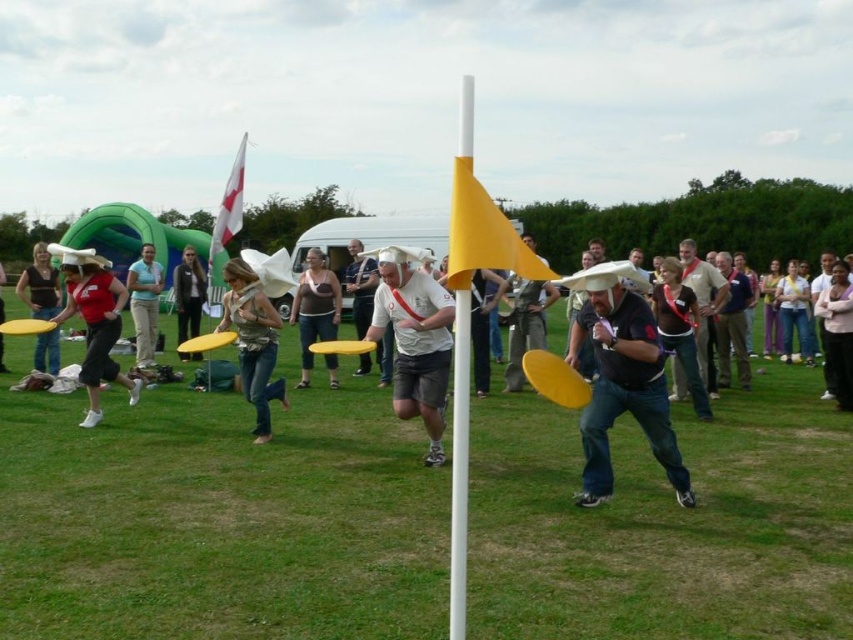
Question: Which object is closer to the camera taking this photo?

Choices:
 (A) matte black tank top at left
 (B) matte white tank top at center
 (C) matte brown shirt at center

Answer: (A)

Question: Can you confirm if matte black tank top at left is smaller than dark gray fabric jacket at center?

Choices:
 (A) no
 (B) yes

Answer: (A)

Question: Which of the following is the farthest from the observer?

Choices:
 (A) matte yellow frisbee at center
 (B) matte red shirt at left
 (C) white fabric flag at upper left

Answer: (C)

Question: Can you confirm if matte white tank top at center is wider than light blue fabric shirt at center?

Choices:
 (A) no
 (B) yes

Answer: (B)

Question: Which object is the closest to the white matte jersey at center?

Choices:
 (A) matte yellow frisbee at center
 (B) matte white tank top at center

Answer: (A)

Question: Observing the image, what is the correct spatial positioning of matte white tank top at center in reference to white cotton shirt at center?

Choices:
 (A) below
 (B) above

Answer: (A)